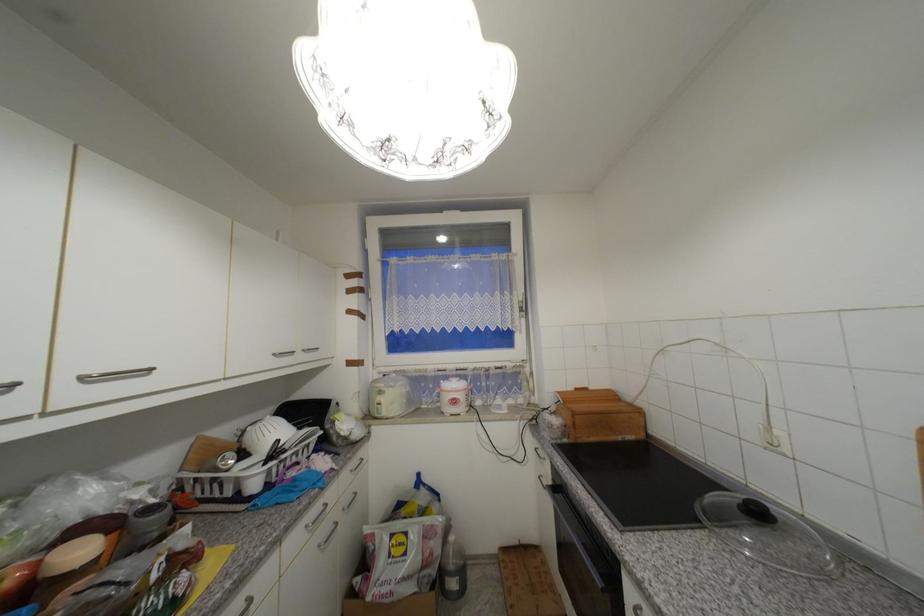
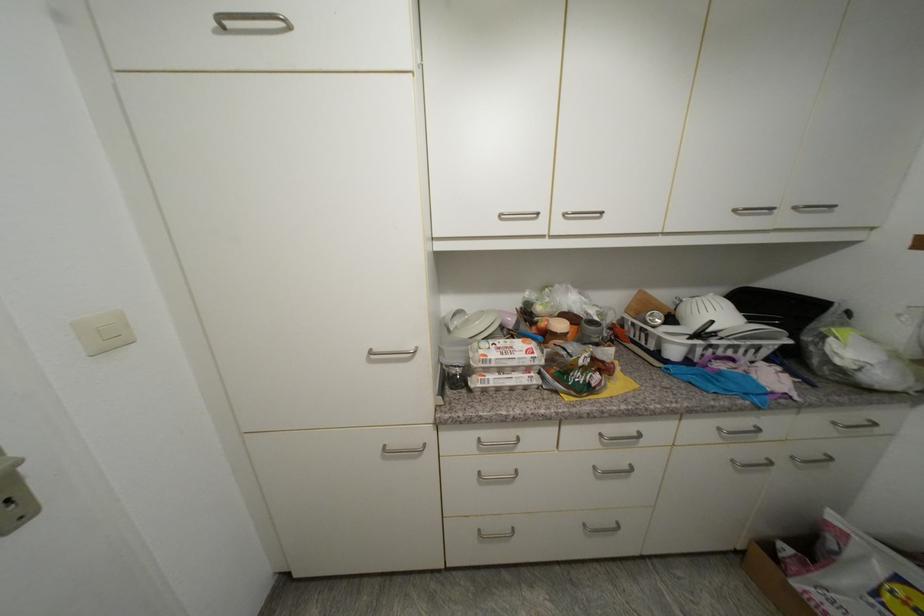
The first image is from the beginning of the video and the second image is from the end. How did the camera likely rotate when shooting the video?

The camera's rotation is toward left-down.